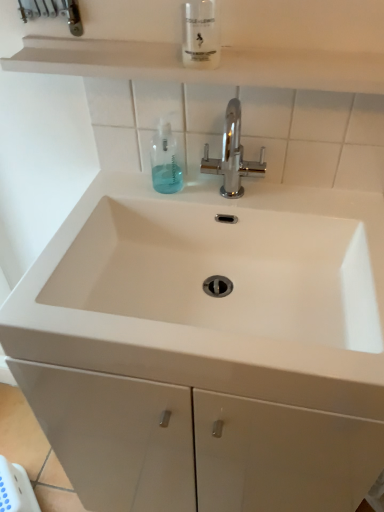
Question: In terms of height, does translucent plastic mouthwash at center, acting as the 1th mouthwash starting from the left, look taller or shorter compared to clear plastic bottle at upper center, which is the 2th mouthwash from bottom to top?

Choices:
 (A) tall
 (B) short

Answer: (B)

Question: From a real-world perspective, is translucent plastic mouthwash at center, positioned as the second mouthwash in front-to-back order, physically located above or below clear plastic bottle at upper center, the 2th mouthwash positioned from the back?

Choices:
 (A) below
 (B) above

Answer: (A)

Question: Which is nearer to the clear plastic bottle at upper center, which is the 1th mouthwash in right-to-left order?

Choices:
 (A) chrome metallic faucet at center
 (B) translucent plastic mouthwash at center, which is counted as the 2th mouthwash, starting from the right
 (C) white matte shelf at upper center
 (D) white matte sink at center

Answer: (C)

Question: Which object is positioned farthest from the white matte shelf at upper center?

Choices:
 (A) clear plastic bottle at upper center, which is the 1th mouthwash in right-to-left order
 (B) translucent plastic mouthwash at center, which is counted as the 1th mouthwash, starting from the back
 (C) white matte sink at center
 (D) chrome metallic faucet at center

Answer: (C)